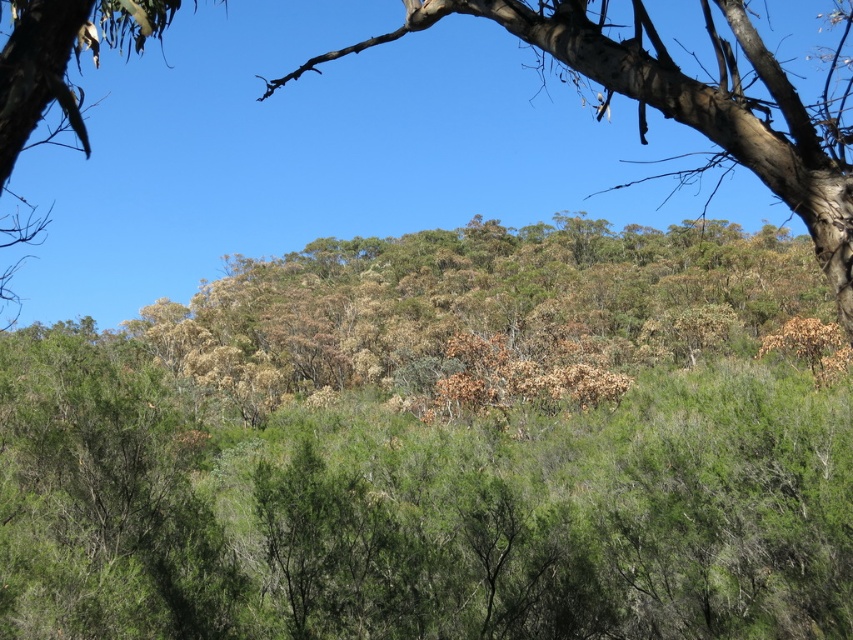
Question: Observing the image, what is the correct spatial positioning of brown/dried leaves at center in reference to green leafy tree at center?

Choices:
 (A) above
 (B) below

Answer: (B)

Question: Which object appears closest to the camera in this image?

Choices:
 (A) brown/dried leaves at center
 (B) green leafy tree at center

Answer: (B)

Question: Is brown/dried leaves at center to the right of green leafy tree at center from the viewer's perspective?

Choices:
 (A) yes
 (B) no

Answer: (A)

Question: Which object appears closest to the camera in this image?

Choices:
 (A) brown/dried leaves at center
 (B) green leafy tree at center

Answer: (B)

Question: Can you confirm if brown/dried leaves at center is smaller than green leafy tree at center?

Choices:
 (A) no
 (B) yes

Answer: (B)

Question: Which object is farther from the camera taking this photo?

Choices:
 (A) brown/dried leaves at center
 (B) green leafy tree at center

Answer: (A)